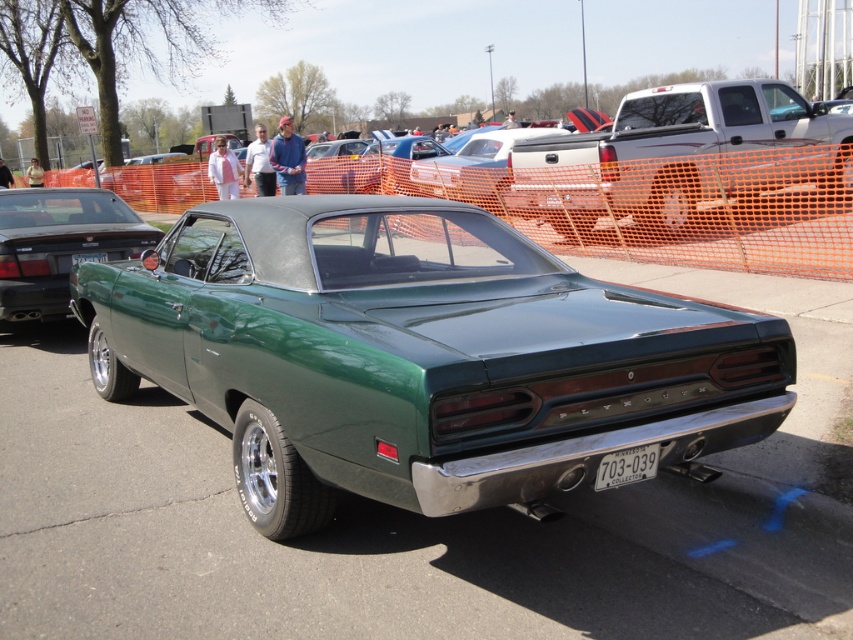
Question: Which is nearer to the green glossy car at center?

Choices:
 (A) silver metallic pickup truck at upper right
 (B) green metallic car at center

Answer: (B)

Question: Which object is the farthest from the green metallic car at center?

Choices:
 (A) white metallic license plate at center
 (B) green glossy car at center
 (C) green matte car at center
 (D) silver metallic pickup truck at upper right

Answer: (C)

Question: Is the position of green metallic car at center more distant than that of green matte car at center?

Choices:
 (A) no
 (B) yes

Answer: (A)

Question: Which object is closer to the camera taking this photo?

Choices:
 (A) green glossy car at center
 (B) white metallic license plate at center
 (C) green matte car at center

Answer: (A)

Question: Can you confirm if green glossy car at center is positioned to the right of silver metallic pickup truck at upper right?

Choices:
 (A) yes
 (B) no

Answer: (B)

Question: In this image, where is silver metallic pickup truck at upper right located relative to green metallic car at center?

Choices:
 (A) left
 (B) right

Answer: (B)